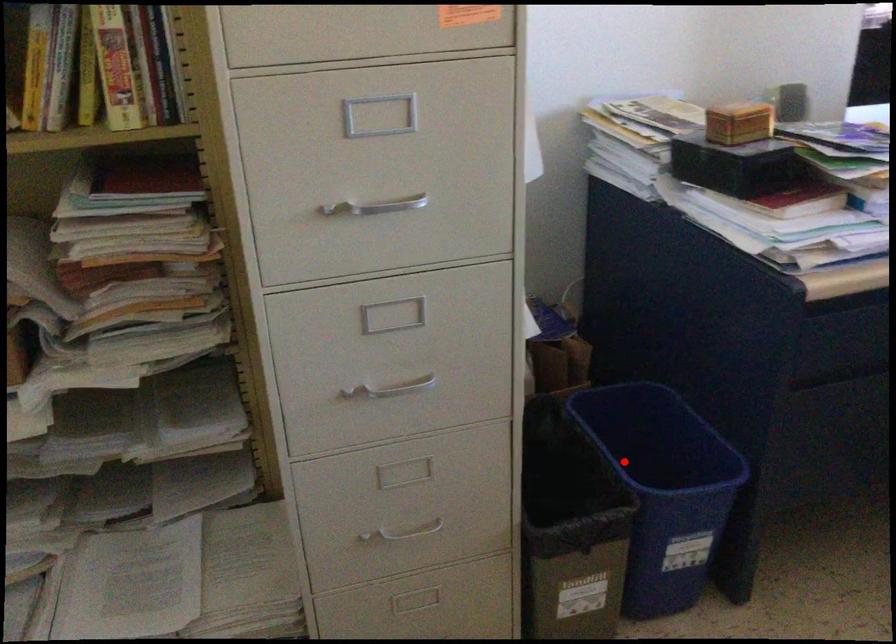
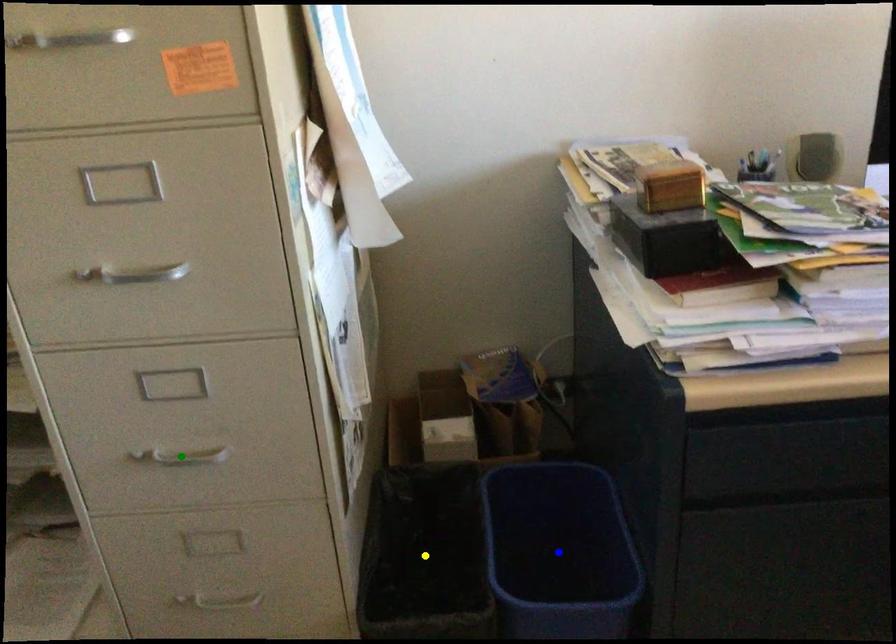
Question: I am providing you with two images of the same scene from different viewpoints. A red point is marked on the first image. You are given multiple points on the second image. In image 2, which mark is for the same physical point as the one in image 1?

Choices:
 (A) blue point
 (B) green point
 (C) yellow point

Answer: (A)